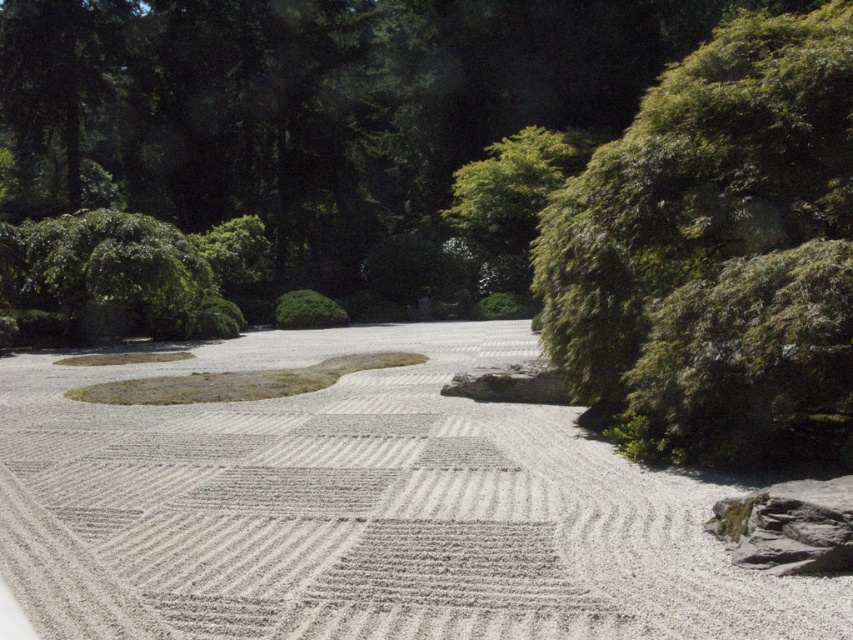
Is point (450, 600) in front of point (474, 392)?

Yes, it is.

Is white textured gravel at center to the left of smooth gray rock at center from the viewer's perspective?

Indeed, white textured gravel at center is positioned on the left side of smooth gray rock at center.

Which is in front, point (469, 440) or point (486, 396)?

Point (469, 440) is more forward.

Find the location of `white textured gravel at center`. white textured gravel at center is located at coordinates (361, 509).

The width and height of the screenshot is (853, 640). What are the coordinates of `green leafy bush at upper right` in the screenshot? It's located at (717, 252).

Is white textured gravel at center closer to camera compared to gray rough rock at lower right?

That is True.

What do you see at coordinates (361, 509) in the screenshot? I see `white textured gravel at center` at bounding box center [361, 509].

You are a GUI agent. You are given a task and a screenshot of the screen. Output one action in this format:
    pyautogui.click(x=<x>, y=<y>)
    Task: Click on the white textured gravel at center
    The height and width of the screenshot is (640, 853).
    Given the screenshot: What is the action you would take?
    pyautogui.click(x=361, y=509)